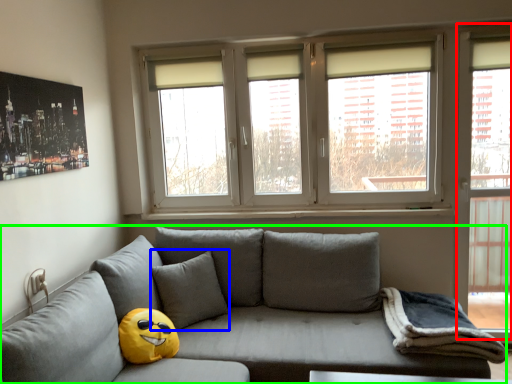
Question: Considering the real-world distances, which object is farthest from glass door (highlighted by a red box)? pillow (highlighted by a blue box) or studio couch (highlighted by a green box)?

Choices:
 (A) pillow
 (B) studio couch

Answer: (A)